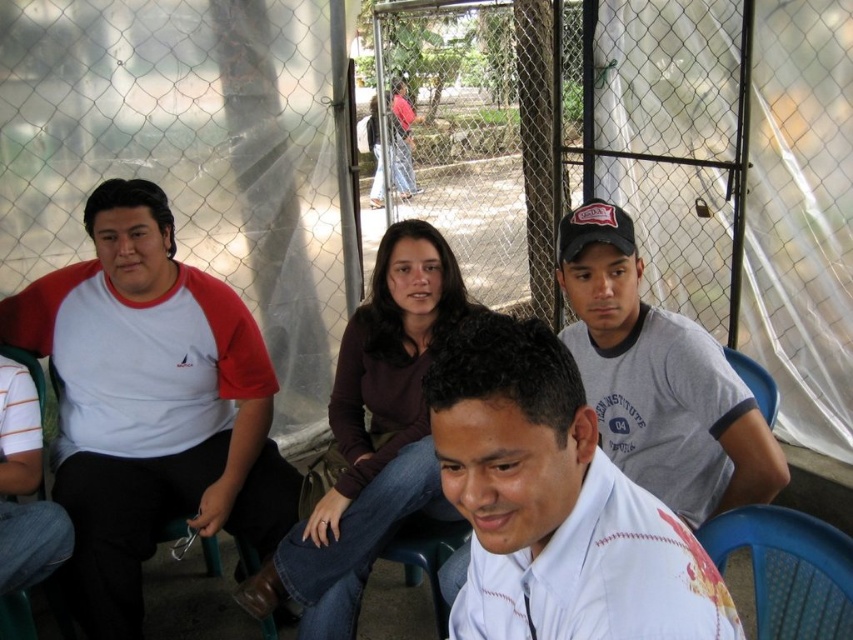
Question: Which point is farther from the camera taking this photo?

Choices:
 (A) (152, 214)
 (B) (521, 612)

Answer: (A)

Question: Does gray cotton t-shirt at upper right have a smaller size compared to blue plastic chair at lower right?

Choices:
 (A) no
 (B) yes

Answer: (A)

Question: Does white matte shirt at center appear on the left side of blue plastic chair at lower right?

Choices:
 (A) yes
 (B) no

Answer: (A)

Question: Which object is closer to the camera taking this photo?

Choices:
 (A) gray cotton t-shirt at upper right
 (B) white matte shirt at center

Answer: (B)

Question: Which object is farther from the camera taking this photo?

Choices:
 (A) blue plastic chair at lower right
 (B) white cotton shirt at left

Answer: (B)

Question: Considering the relative positions of white matte shirt at center and blue plastic chair at lower right in the image provided, where is white matte shirt at center located with respect to blue plastic chair at lower right?

Choices:
 (A) below
 (B) above

Answer: (B)